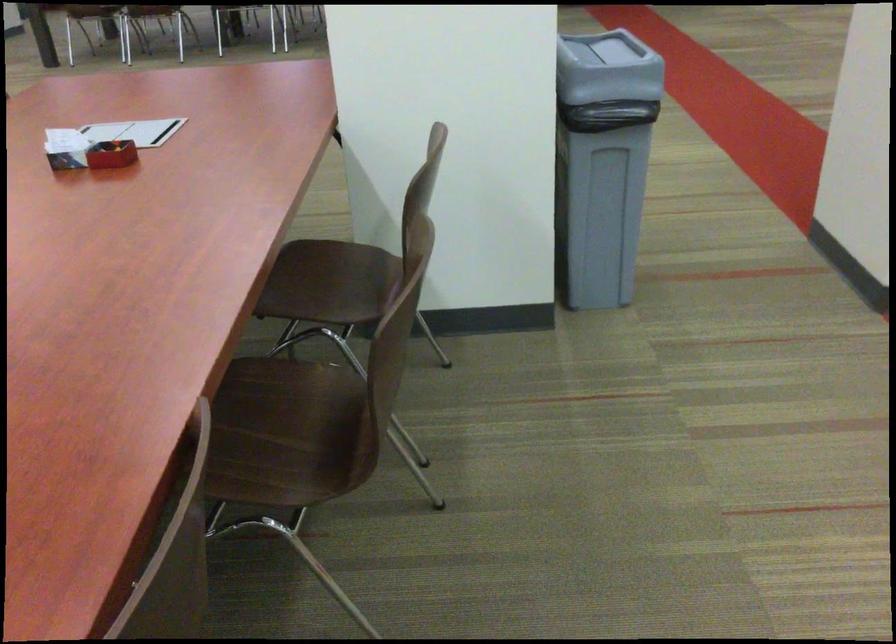
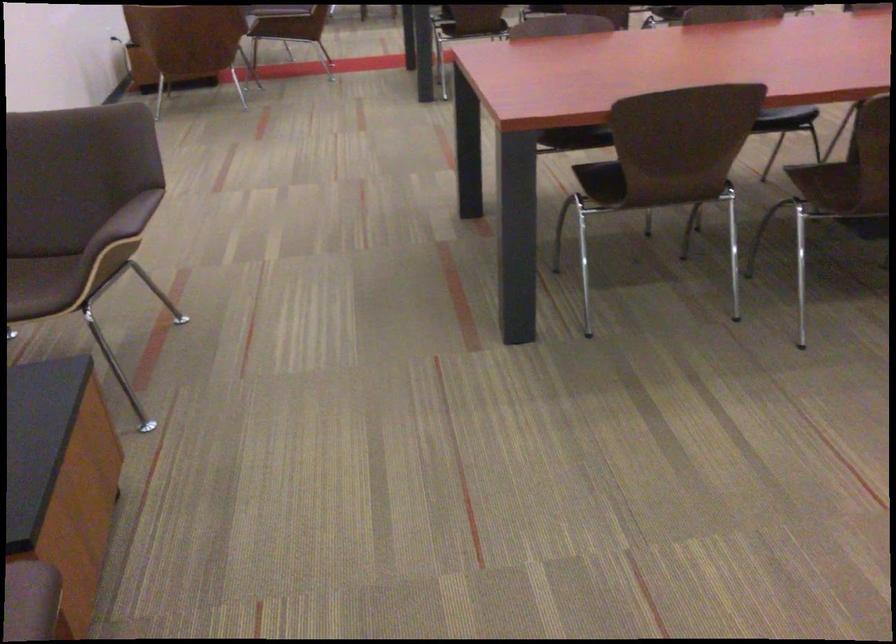
The point at (244,486) is marked in the first image. Where is the corresponding point in the second image?

(819, 183)